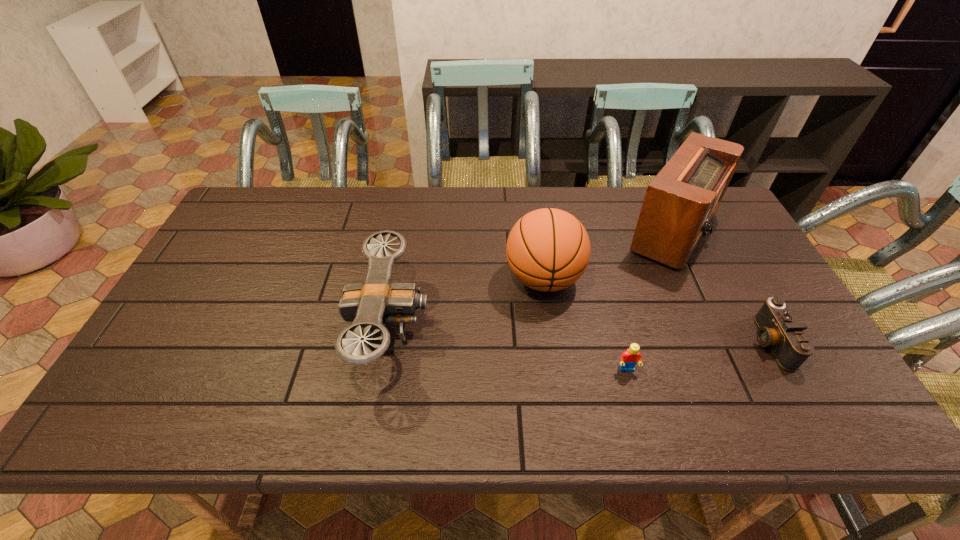
Locate an element on the screen. This screenshot has width=960, height=540. blank area located 0.250m on the lens of the camera is located at coordinates (653, 342).

Where is `vacant area located on the lens of the camera`? vacant area located on the lens of the camera is located at coordinates (684, 342).

Where is `vacant space located on the lens of the camera`? Image resolution: width=960 pixels, height=540 pixels. vacant space located on the lens of the camera is located at coordinates (708, 342).

The image size is (960, 540). Identify the location of object that is at the far edge. (680, 202).

Where is `object that is at the near edge`? The height and width of the screenshot is (540, 960). object that is at the near edge is located at coordinates (377, 301).

Find the location of a particular element. The height and width of the screenshot is (540, 960). radio receiver positioned at the right edge is located at coordinates (680, 202).

Where is `camera that is at the right edge`? This screenshot has width=960, height=540. camera that is at the right edge is located at coordinates (778, 329).

Where is `object that is at the far right corner`? This screenshot has height=540, width=960. object that is at the far right corner is located at coordinates pyautogui.click(x=680, y=202).

Where is `free space at the far edge`? The image size is (960, 540). free space at the far edge is located at coordinates (307, 220).

Locate an element on the screen. vacant region at the near edge of the desktop is located at coordinates (480, 426).